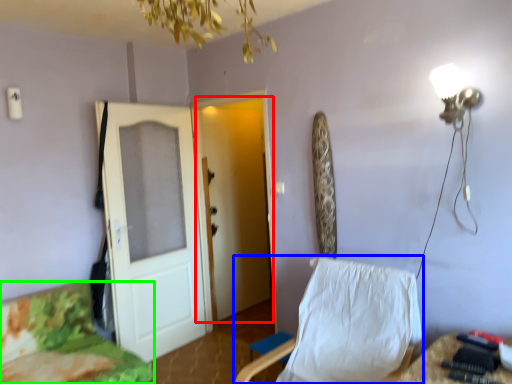
Question: Which object is the closest to the door (highlighted by a red box)? Choose among these: chair (highlighted by a blue box) or furniture (highlighted by a green box).

Choices:
 (A) chair
 (B) furniture

Answer: (B)